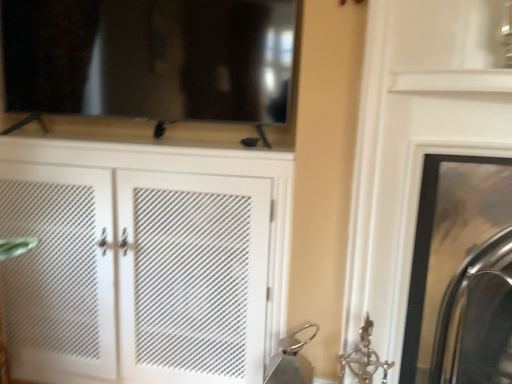
You are a GUI agent. You are given a task and a screenshot of the screen. Output one action in this format:
    pyautogui.click(x=<x>, y=<y>)
    Task: Click on the metallic silver fireplace at right
    
    Given the screenshot: What is the action you would take?
    pyautogui.click(x=431, y=235)

What do you see at coordinates (431, 235) in the screenshot?
I see `metallic silver fireplace at right` at bounding box center [431, 235].

Measure the distance between point (416, 274) and camera.

The distance of point (416, 274) from camera is 1.26 meters.

What do you see at coordinates (149, 260) in the screenshot?
I see `white mesh cabinet at center` at bounding box center [149, 260].

Locate an element on the screen. white mesh cabinet at center is located at coordinates (149, 260).

What is the approximate width of white mesh cabinet at center?

white mesh cabinet at center is 41.45 centimeters wide.

Find the location of a particular element. The width and height of the screenshot is (512, 384). metallic silver fireplace at right is located at coordinates pos(431,235).

Considering the positions of objects white mesh cabinet at center and metallic silver fireplace at right in the image provided, who is more to the left, white mesh cabinet at center or metallic silver fireplace at right?

From the viewer's perspective, white mesh cabinet at center appears more on the left side.

Which object is further away from the camera, white mesh cabinet at center or metallic silver fireplace at right?

white mesh cabinet at center.

Which is in front, point (133, 259) or point (426, 201)?

Point (426, 201)

From the image's perspective, is white mesh cabinet at center on metallic silver fireplace at right?

Indeed, from the image's perspective, white mesh cabinet at center is shown above metallic silver fireplace at right.

From a real-world perspective, is white mesh cabinet at center on metallic silver fireplace at right?

Incorrect, from a real-world perspective, white mesh cabinet at center is lower than metallic silver fireplace at right.

Which of these two, white mesh cabinet at center or metallic silver fireplace at right, is thinner?

white mesh cabinet at center is thinner.

Considering the sizes of white mesh cabinet at center and metallic silver fireplace at right in the image, is white mesh cabinet at center taller or shorter than metallic silver fireplace at right?

white mesh cabinet at center is taller than metallic silver fireplace at right.

Considering the relative sizes of white mesh cabinet at center and metallic silver fireplace at right in the image provided, is white mesh cabinet at center bigger than metallic silver fireplace at right?

Yes.

Is white mesh cabinet at center surrounding metallic silver fireplace at right?

No, white mesh cabinet at center does not contain metallic silver fireplace at right.

Is white mesh cabinet at center not near metallic silver fireplace at right?

No.

Does white mesh cabinet at center turn towards metallic silver fireplace at right?

No, white mesh cabinet at center is not aimed at metallic silver fireplace at right.

Based on the photo, what's the angular difference between white mesh cabinet at center and metallic silver fireplace at right's facing directions?

1.28 degrees separate the facing orientations of white mesh cabinet at center and metallic silver fireplace at right.

Where is `cupboard behind the metallic silver fireplace at right`? The height and width of the screenshot is (384, 512). cupboard behind the metallic silver fireplace at right is located at coordinates (149, 260).

Which is more to the right, metallic silver fireplace at right or white mesh cabinet at center?

From the viewer's perspective, metallic silver fireplace at right appears more on the right side.

Does metallic silver fireplace at right lie in front of white mesh cabinet at center?

Yes, metallic silver fireplace at right is closer to the viewer.

Does point (476, 156) come farther from viewer compared to point (125, 293)?

No, it is not.

From the image's perspective, is metallic silver fireplace at right below white mesh cabinet at center?

Yes.

From a real-world perspective, which object stands above the other?

metallic silver fireplace at right, from a real-world perspective.

From the picture: Between metallic silver fireplace at right and white mesh cabinet at center, which one has larger width?

Wider between the two is metallic silver fireplace at right.

Is metallic silver fireplace at right shorter than white mesh cabinet at center?

Yes, metallic silver fireplace at right is shorter than white mesh cabinet at center.

Can you confirm if metallic silver fireplace at right is bigger than white mesh cabinet at center?

No, metallic silver fireplace at right is not bigger than white mesh cabinet at center.

Is metallic silver fireplace at right located outside white mesh cabinet at center?

Absolutely, metallic silver fireplace at right is external to white mesh cabinet at center.

Are metallic silver fireplace at right and white mesh cabinet at center far apart?

metallic silver fireplace at right is actually quite close to white mesh cabinet at center.

Is metallic silver fireplace at right aimed at white mesh cabinet at center?

No, metallic silver fireplace at right is not facing towards white mesh cabinet at center.

How far apart are metallic silver fireplace at right and white mesh cabinet at center?

They are 81.78 centimeters apart.

Identify the location of fireplace above the white mesh cabinet at center (from a real-world perspective). (431, 235).

Where is `cupboard located on the left of metallic silver fireplace at right`? Image resolution: width=512 pixels, height=384 pixels. cupboard located on the left of metallic silver fireplace at right is located at coordinates (149, 260).

Find the location of a particular element. The image size is (512, 384). cupboard located behind the metallic silver fireplace at right is located at coordinates (149, 260).